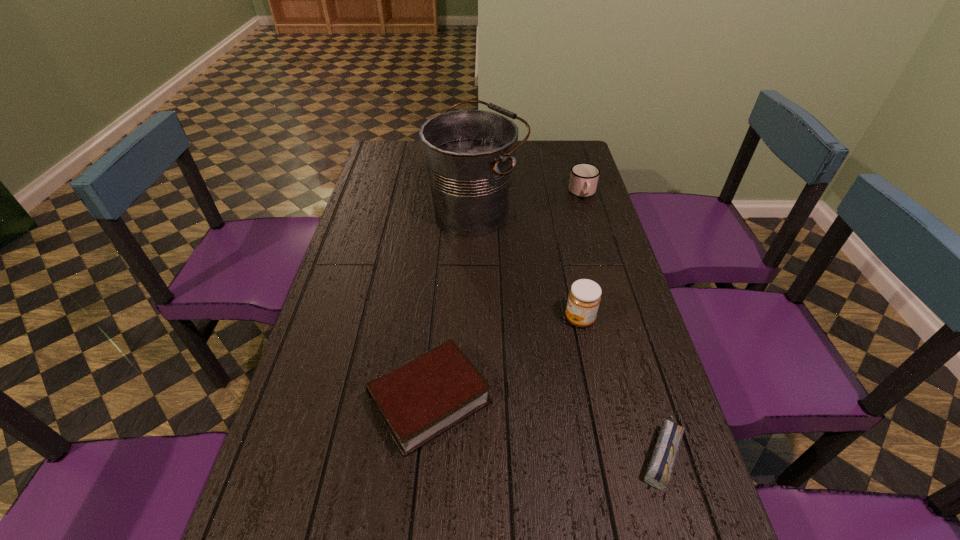
Identify the location of vacant region at the far right corner of the desktop. (558, 145).

Where is `vacant point located between the second shortest object and the tallest object`? vacant point located between the second shortest object and the tallest object is located at coordinates (453, 306).

Where is `free space between the tallest object and the second shortest object`? The width and height of the screenshot is (960, 540). free space between the tallest object and the second shortest object is located at coordinates (453, 306).

You are a GUI agent. You are given a task and a screenshot of the screen. Output one action in this format:
    pyautogui.click(x=<x>, y=<y>)
    Task: Click on the vacant space that is in between the Bible and the tallest object
    
    Given the screenshot: What is the action you would take?
    pyautogui.click(x=453, y=306)

Image resolution: width=960 pixels, height=540 pixels. I want to click on vacant point located between the bucket and the mug, so pos(529,202).

Where is `blank region between the third object from left to right and the tallest object`? blank region between the third object from left to right and the tallest object is located at coordinates (527, 265).

Locate an element on the screen. The image size is (960, 540). vacant area that lies between the bucket and the mug is located at coordinates (529, 202).

Identify the location of blank region between the bucket and the third shortest object. Image resolution: width=960 pixels, height=540 pixels. (529, 202).

Locate an element on the screen. object that is the third closest to the shortest object is located at coordinates (469, 155).

Find the location of a particular element. the third closest object to the tallest object is located at coordinates click(419, 400).